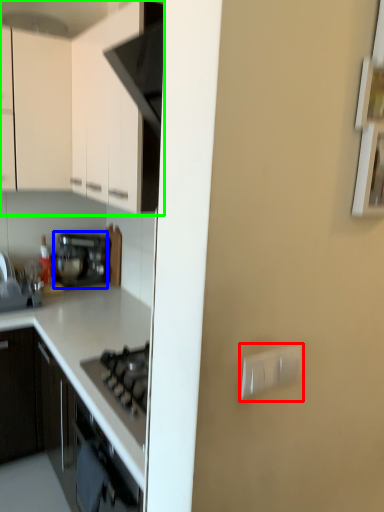
Question: Which object is the farthest from electric outlet (highlighted by a red box)? Choose among these: kitchen appliance (highlighted by a blue box) or cabinetry (highlighted by a green box).

Choices:
 (A) kitchen appliance
 (B) cabinetry

Answer: (A)